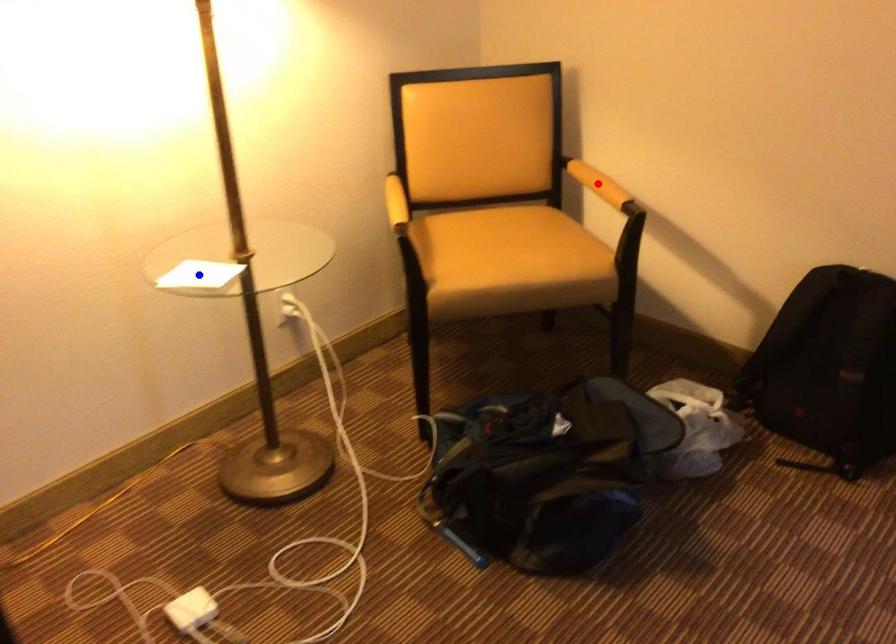
Question: Which of the two points in the image is closer to the camera?

Choices:
 (A) Blue point is closer.
 (B) Red point is closer.

Answer: (A)